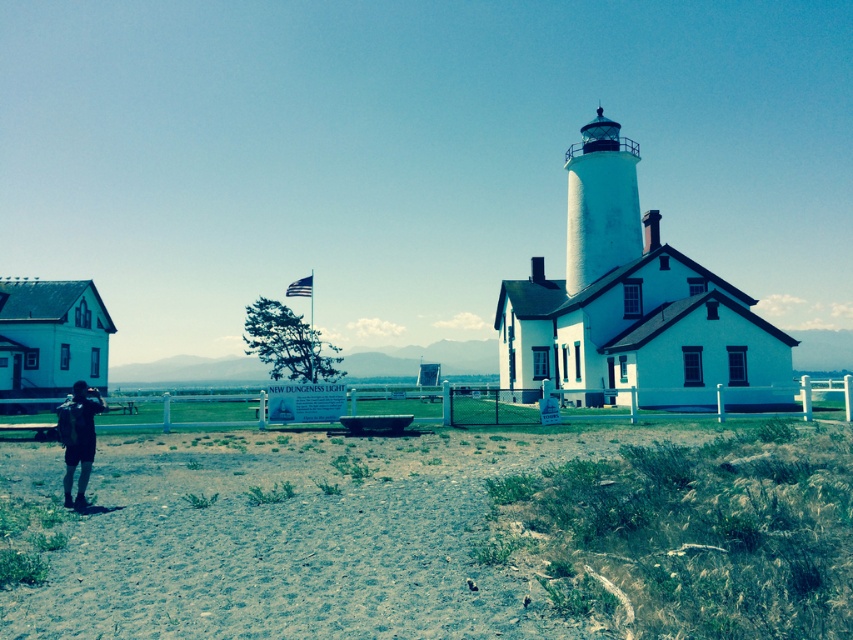
Question: Which object appears closest to the camera in this image?

Choices:
 (A) dark blue jeans at lower left
 (B) dirt/gritty ground at lower left

Answer: (B)

Question: Which point appears closest to the camera in this image?

Choices:
 (A) (91, 440)
 (B) (502, 513)

Answer: (B)

Question: Which object appears closest to the camera in this image?

Choices:
 (A) dark blue jeans at lower left
 (B) dirt/gritty ground at lower left

Answer: (B)

Question: From the image, what is the correct spatial relationship of dirt/gritty ground at lower left in relation to dark blue jeans at lower left?

Choices:
 (A) right
 (B) left

Answer: (A)

Question: Observing the image, what is the correct spatial positioning of dirt/gritty ground at lower left in reference to dark blue jeans at lower left?

Choices:
 (A) above
 (B) below

Answer: (B)

Question: From the image, what is the correct spatial relationship of dirt/gritty ground at lower left in relation to dark blue jeans at lower left?

Choices:
 (A) left
 (B) right

Answer: (B)